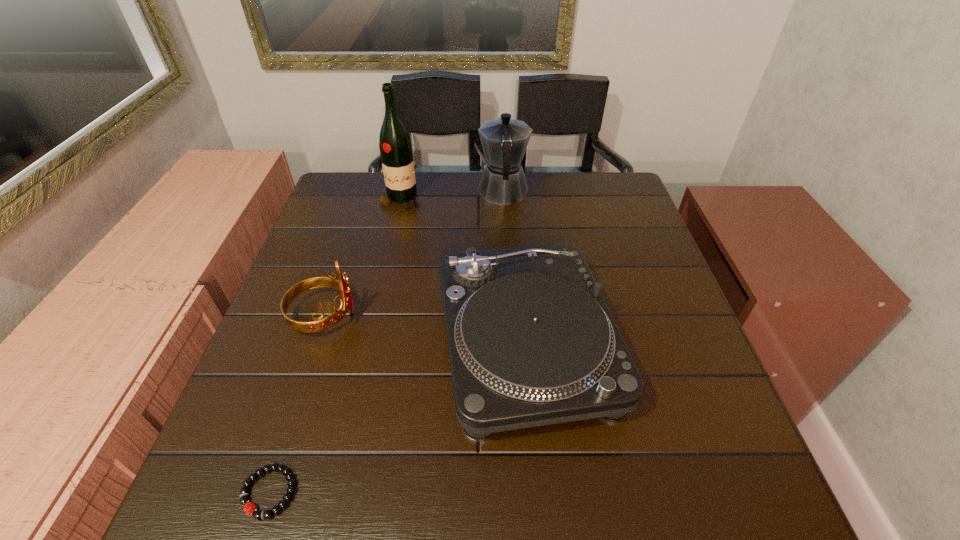
This screenshot has height=540, width=960. In order to click on wine bottle located at the far edge in this screenshot , I will do `click(395, 145)`.

You are a GUI agent. You are given a task and a screenshot of the screen. Output one action in this format:
    pyautogui.click(x=<x>, y=<y>)
    Task: Click on the coffeepot located in the far edge section of the desktop
    
    Given the screenshot: What is the action you would take?
    pyautogui.click(x=504, y=140)

I want to click on object present at the near edge, so click(249, 508).

Where is `wine bottle that is positioned at the left edge`? This screenshot has width=960, height=540. wine bottle that is positioned at the left edge is located at coordinates click(395, 145).

The width and height of the screenshot is (960, 540). Identify the location of tiara that is positioned at the left edge. [x=320, y=324].

Locate an element on the screen. The width and height of the screenshot is (960, 540). bracelet present at the left edge is located at coordinates (249, 508).

Find the location of a particular element. This screenshot has height=540, width=960. object that is positioned at the far left corner is located at coordinates (395, 145).

Where is `object located at the near left corner`? This screenshot has height=540, width=960. object located at the near left corner is located at coordinates (249, 508).

In the image, there is a desktop. Where is `free region at the far edge`? free region at the far edge is located at coordinates (398, 210).

In the image, there is a desktop. Identify the location of vacant space at the near edge. This screenshot has width=960, height=540. (424, 483).